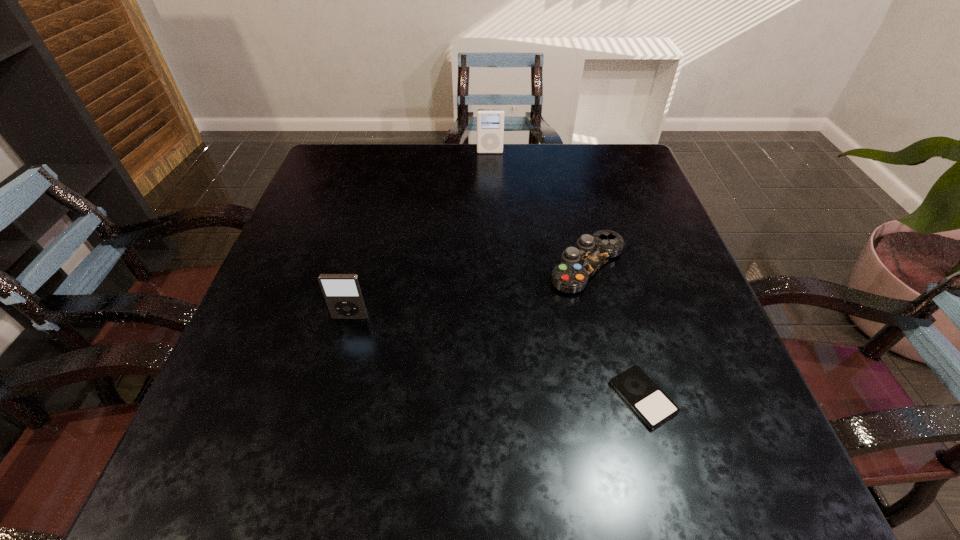
The height and width of the screenshot is (540, 960). I want to click on vacant space at the far right corner of the desktop, so click(x=613, y=179).

Locate an element on the screen. Image resolution: width=960 pixels, height=540 pixels. vacant space at the near right corner of the desktop is located at coordinates (725, 496).

Identify the location of vacant region between the second iPod from right to left and the leftmost iPod. (420, 235).

At what (x,y) coordinates should I click in order to perform the action: click on free area in between the leftmost iPod and the nearest iPod. Please return your answer as a coordinate pair (x, y). The image size is (960, 540). Looking at the image, I should click on (497, 357).

The height and width of the screenshot is (540, 960). I want to click on blank region between the second iPod from left to right and the second shortest object, so click(539, 209).

At what (x,y) coordinates should I click in order to perform the action: click on blank region between the second farthest iPod and the second object from left to right. Please return your answer as a coordinate pair (x, y). Looking at the image, I should click on (420, 235).

I want to click on empty location between the shortest object and the leftmost iPod, so click(497, 357).

You are a GUI agent. You are given a task and a screenshot of the screen. Output one action in this format:
    pyautogui.click(x=<x>, y=<y>)
    Task: Click on the unoccupied position between the second object from left to right and the second farthest iPod
    
    Given the screenshot: What is the action you would take?
    pyautogui.click(x=420, y=235)

Locate an element on the screen. This screenshot has width=960, height=540. free area in between the nearest iPod and the third nearest object is located at coordinates (615, 332).

The height and width of the screenshot is (540, 960). I want to click on free space between the leftmost object and the shortest iPod, so click(x=497, y=357).